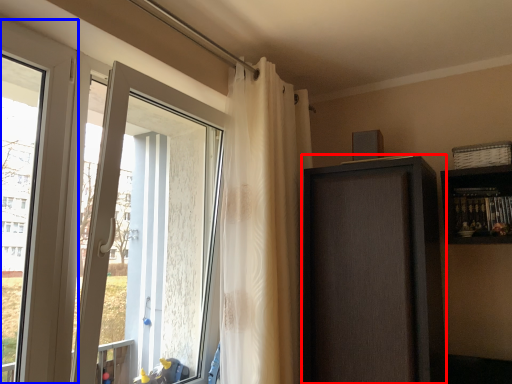
Question: Which of the following is the closest to the observer, screen door (highlighted by a red box) or window (highlighted by a blue box)?

Choices:
 (A) screen door
 (B) window

Answer: (B)